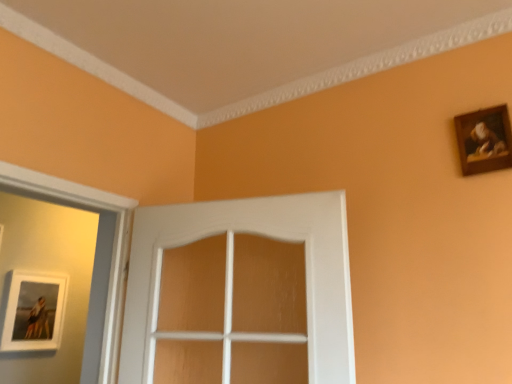
Question: Can you confirm if matte white picture frame at lower left, which ranks as the 1th picture frame in back-to-front order, is bigger than white wood door at center?

Choices:
 (A) yes
 (B) no

Answer: (B)

Question: Are matte white picture frame at lower left, positioned as the second picture frame in top-to-bottom order, and white wood door at center making contact?

Choices:
 (A) yes
 (B) no

Answer: (B)

Question: From the image's perspective, does matte white picture frame at lower left, positioned as the second picture frame in top-to-bottom order, appear lower than white wood door at center?

Choices:
 (A) yes
 (B) no

Answer: (A)

Question: Can you confirm if matte white picture frame at lower left, which is counted as the 2th picture frame, starting from the right, is shorter than white wood door at center?

Choices:
 (A) yes
 (B) no

Answer: (A)

Question: From the image's perspective, is matte white picture frame at lower left, which is counted as the 2th picture frame, starting from the right, above white wood door at center?

Choices:
 (A) no
 (B) yes

Answer: (A)

Question: Is white wood door at center inside or outside of matte white picture frame at lower left, which is the first picture frame from bottom to top?

Choices:
 (A) inside
 (B) outside

Answer: (B)

Question: Visually, is white wood door at center positioned to the left or to the right of matte white picture frame at lower left, which is the first picture frame from bottom to top?

Choices:
 (A) left
 (B) right

Answer: (B)

Question: Based on their sizes in the image, would you say white wood door at center is bigger or smaller than matte white picture frame at lower left, the 1th picture frame when ordered from left to right?

Choices:
 (A) small
 (B) big

Answer: (B)

Question: Considering their positions, is white wood door at center located in front of or behind matte white picture frame at lower left, which ranks as the 1th picture frame in back-to-front order?

Choices:
 (A) front
 (B) behind

Answer: (A)

Question: Is matte white picture frame at lower left, positioned as the second picture frame in top-to-bottom order, inside the boundaries of white wood door at center, or outside?

Choices:
 (A) inside
 (B) outside

Answer: (B)

Question: From the image's perspective, is matte white picture frame at lower left, positioned as the second picture frame in top-to-bottom order, located above or below white wood door at center?

Choices:
 (A) above
 (B) below

Answer: (B)

Question: Considering the positions of point (45, 307) and point (275, 211), is point (45, 307) closer or farther from the camera than point (275, 211)?

Choices:
 (A) farther
 (B) closer

Answer: (A)

Question: Is matte white picture frame at lower left, which ranks as the 1th picture frame in back-to-front order, bigger or smaller than white wood door at center?

Choices:
 (A) small
 (B) big

Answer: (A)

Question: From the image's perspective, is white wood door at center located above or below wooden frame at upper right, which is counted as the first picture frame, starting from the front?

Choices:
 (A) below
 (B) above

Answer: (A)

Question: In terms of height, does white wood door at center look taller or shorter compared to wooden frame at upper right, the first picture frame viewed from the top?

Choices:
 (A) short
 (B) tall

Answer: (B)